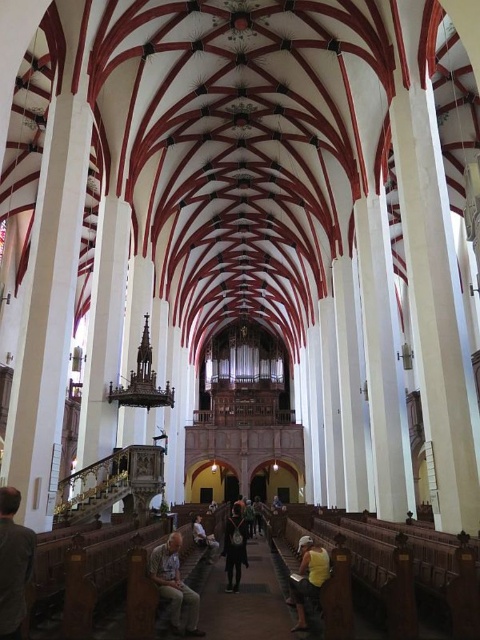
Can you confirm if light brown leather jacket at lower center is thinner than dark blue fabric at center?

No, light brown leather jacket at lower center is not thinner than dark blue fabric at center.

This screenshot has height=640, width=480. Describe the element at coordinates (175, 586) in the screenshot. I see `light brown leather jacket at lower center` at that location.

The width and height of the screenshot is (480, 640). What do you see at coordinates (175, 586) in the screenshot? I see `light brown leather jacket at lower center` at bounding box center [175, 586].

Where is `light brown leather jacket at lower center`? This screenshot has height=640, width=480. light brown leather jacket at lower center is located at coordinates pyautogui.click(x=175, y=586).

Is gray fabric jacket at lower left bigger than light brown leather jacket at lower center?

Actually, gray fabric jacket at lower left might be smaller than light brown leather jacket at lower center.

Is gray fabric jacket at lower left to the left of light brown leather jacket at lower center from the viewer's perspective?

Yes, gray fabric jacket at lower left is to the left of light brown leather jacket at lower center.

Where is `gray fabric jacket at lower left`? The height and width of the screenshot is (640, 480). gray fabric jacket at lower left is located at coordinates (13, 564).

Can you confirm if light brown leather jacket at lower center is thinner than yellow matte shirt at center?

Incorrect, light brown leather jacket at lower center's width is not less than yellow matte shirt at center's.

In the scene shown: Does light brown leather jacket at lower center appear on the left side of yellow matte shirt at center?

Indeed, light brown leather jacket at lower center is positioned on the left side of yellow matte shirt at center.

This screenshot has height=640, width=480. Describe the element at coordinates (175, 586) in the screenshot. I see `light brown leather jacket at lower center` at that location.

You are a GUI agent. You are given a task and a screenshot of the screen. Output one action in this format:
    pyautogui.click(x=<x>, y=<y>)
    Task: Click on the light brown leather jacket at lower center
    
    Given the screenshot: What is the action you would take?
    pyautogui.click(x=175, y=586)